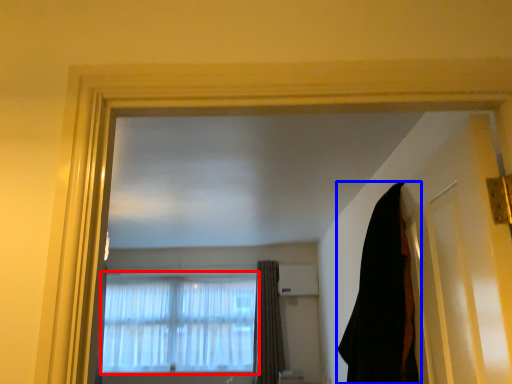
Question: Among these objects, which one is farthest to the camera, window (highlighted by a red box) or curtain (highlighted by a blue box)?

Choices:
 (A) window
 (B) curtain

Answer: (A)